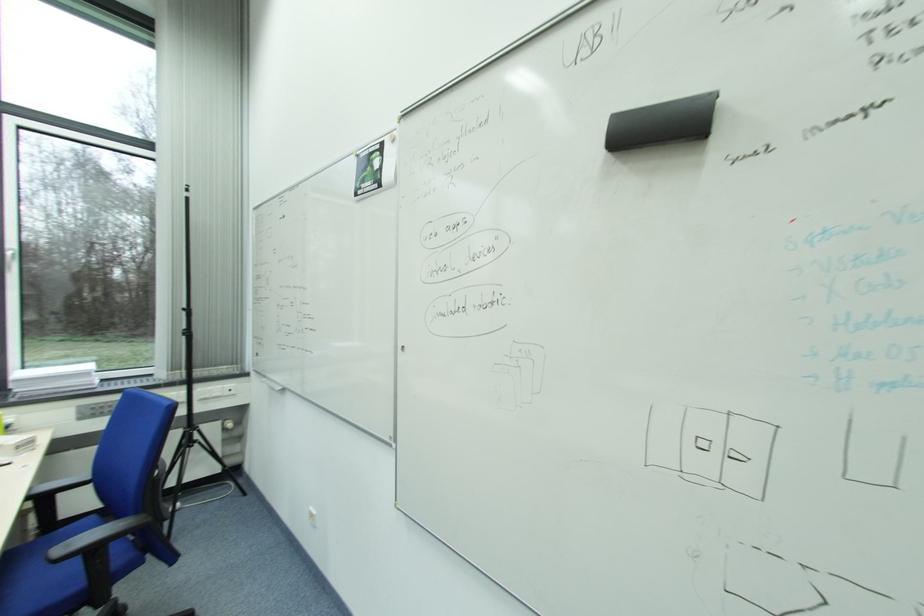
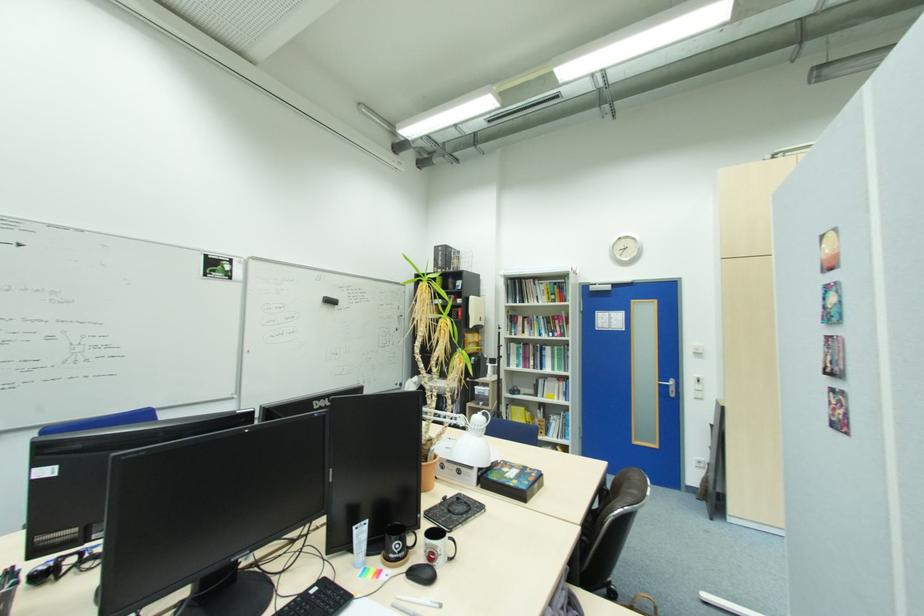
Question: I am providing you with two images of the same scene from different viewpoints. Please identify which objects are invisible in image2.

Choices:
 (A) black chair armrest
 (B) white dispenser lever
 (C) red illuminated switch
 (D) black coffee mug

Answer: (A)